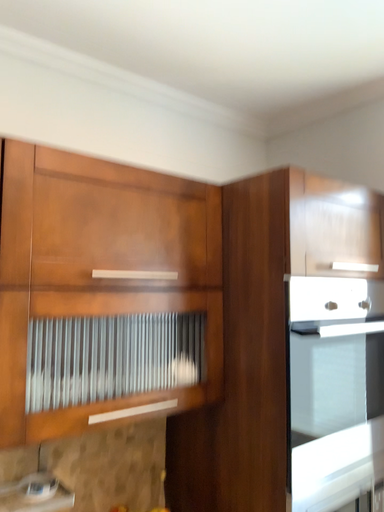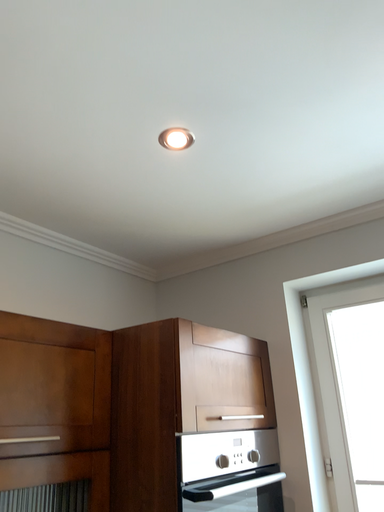
Question: How did the camera likely rotate when shooting the video?

Choices:
 (A) rotated left
 (B) rotated right

Answer: (B)